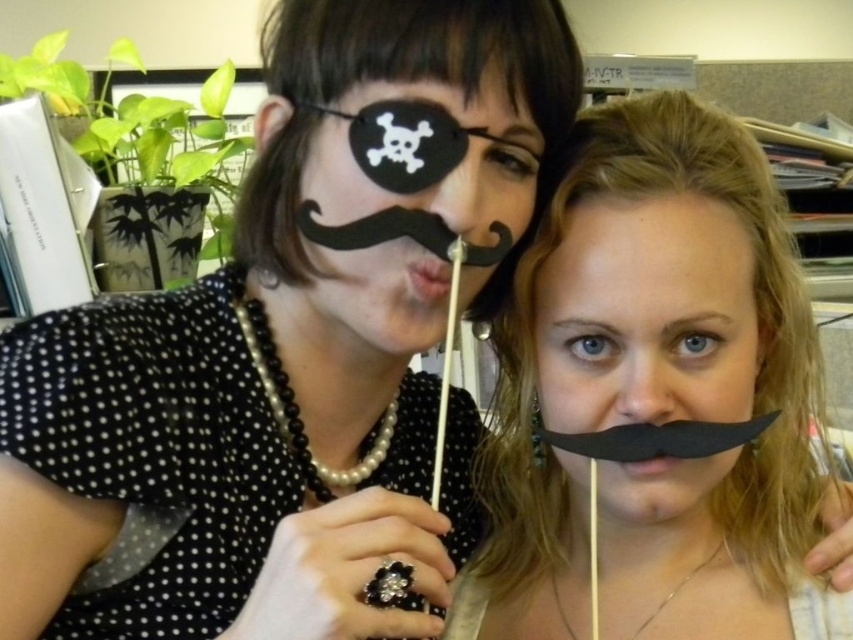
Question: Does black paper mustache at upper center come in front of black matte mustache at center?

Choices:
 (A) yes
 (B) no

Answer: (A)

Question: Which point is farther to the camera?

Choices:
 (A) (403, 259)
 (B) (676, 595)
 (C) (653, 502)

Answer: (B)

Question: Is black paper mustache at upper center to the right of black paper mustache at center from the viewer's perspective?

Choices:
 (A) no
 (B) yes

Answer: (B)

Question: Based on their relative distances, which object is nearer to the black paper mustache at upper center?

Choices:
 (A) black matte mustache at center
 (B) black paper mustache at center

Answer: (A)

Question: Which point appears closest to the camera in this image?

Choices:
 (A) (604, 396)
 (B) (328, 168)

Answer: (B)

Question: Is black paper mustache at upper center positioned behind black paper mustache at center?

Choices:
 (A) yes
 (B) no

Answer: (A)